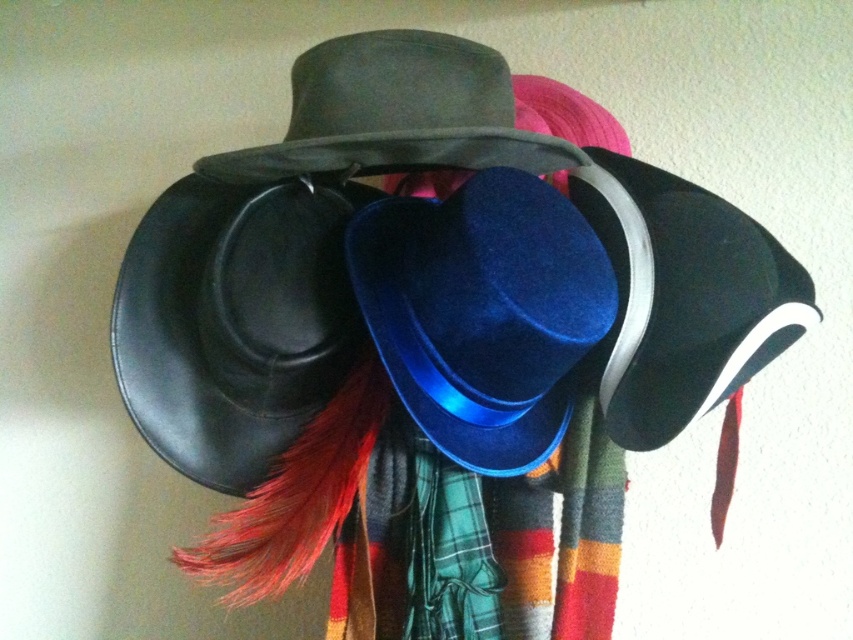
Question: Does velvet blue cowboy hat at center appear over matte black fedora at center?

Choices:
 (A) yes
 (B) no

Answer: (B)

Question: Among these points, which one is nearest to the camera?

Choices:
 (A) (213, 168)
 (B) (461, 356)

Answer: (B)

Question: In this image, where is velvet blue cowboy hat at center located relative to matte black fedora at center?

Choices:
 (A) above
 (B) below

Answer: (B)

Question: Can you confirm if velvet blue cowboy hat at center is positioned above matte black fedora at center?

Choices:
 (A) no
 (B) yes

Answer: (A)

Question: Which point is closer to the camera?

Choices:
 (A) matte black fedora at center
 (B) velvet blue cowboy hat at center

Answer: (A)